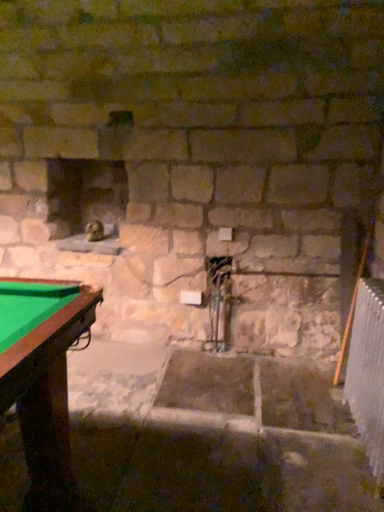
What is the approximate height of white textured radiator at right?

white textured radiator at right is 74.94 centimeters in height.

What do you see at coordinates (368, 371) in the screenshot?
I see `white textured radiator at right` at bounding box center [368, 371].

Identify the location of white textured radiator at right. The width and height of the screenshot is (384, 512). (368, 371).

Locate an element on the screen. This screenshot has width=384, height=512. white textured radiator at right is located at coordinates (368, 371).